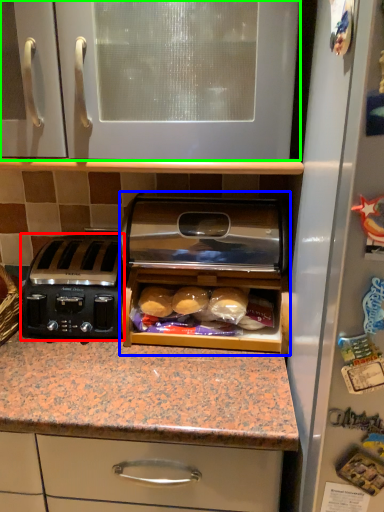
Question: Based on their relative distances, which object is farther from toaster (highlighted by a red box)? Choose from home appliance (highlighted by a blue box) and cabinetry (highlighted by a green box).

Choices:
 (A) home appliance
 (B) cabinetry

Answer: (B)